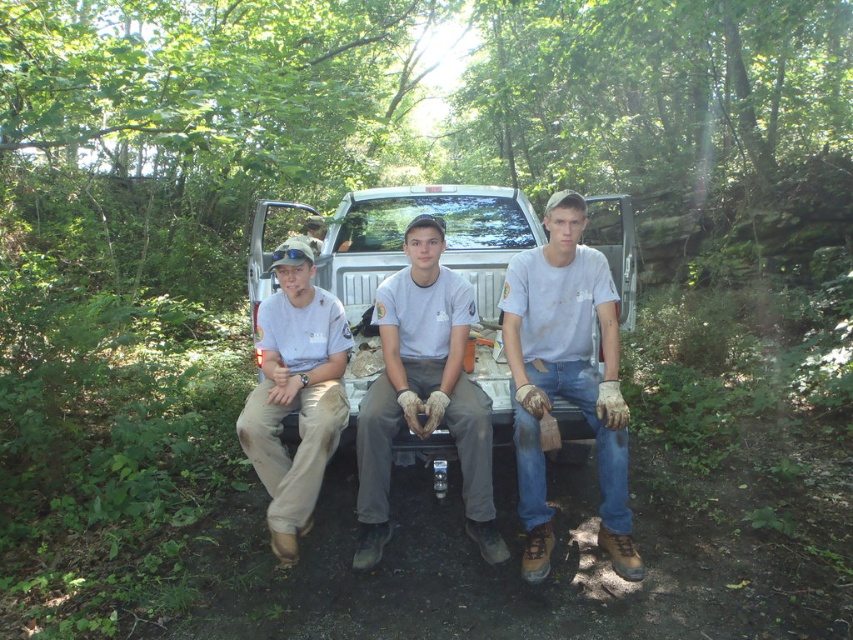
Question: Among these points, which one is nearest to the camera?

Choices:
 (A) (573, 333)
 (B) (419, 230)

Answer: (B)

Question: Does worn denim jeans at center appear on the left side of tan fabric shirt at center?

Choices:
 (A) no
 (B) yes

Answer: (A)

Question: Is worn denim jeans at center positioned before gray cotton shirt at center?

Choices:
 (A) yes
 (B) no

Answer: (A)

Question: Among these objects, which one is nearest to the camera?

Choices:
 (A) tan fabric shirt at center
 (B) worn denim jeans at center

Answer: (B)

Question: Which object appears farthest from the camera in this image?

Choices:
 (A) tan fabric shirt at center
 (B) worn denim jeans at center
 (C) gray cotton shirt at center

Answer: (C)

Question: Does worn denim jeans at center have a lesser width compared to gray cotton shirt at center?

Choices:
 (A) yes
 (B) no

Answer: (A)